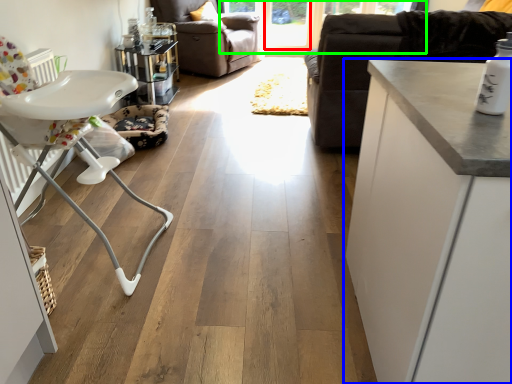
Question: Estimate the real-world distances between objects in this image. Which object is closer to window screen (highlighted by a red box), cabinetry (highlighted by a blue box) or window screen (highlighted by a green box)?

Choices:
 (A) cabinetry
 (B) window screen

Answer: (B)